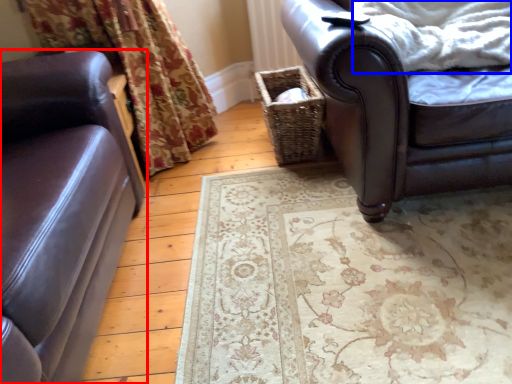
Question: Which object is further to the camera taking this photo, studio couch (highlighted by a red box) or blanket (highlighted by a blue box)?

Choices:
 (A) studio couch
 (B) blanket

Answer: (B)